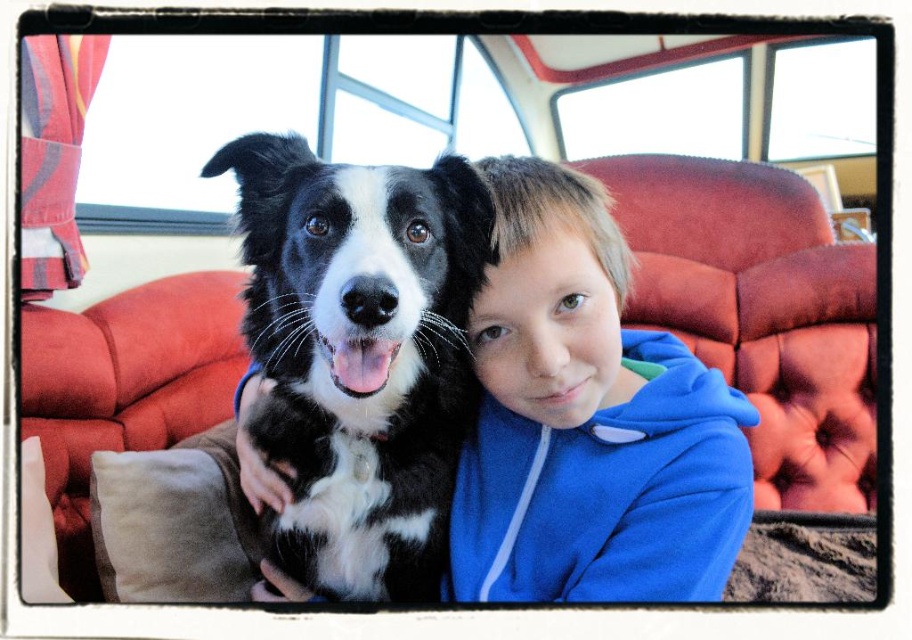
Question: Can you confirm if blue fleece jacket at center is wider than black and white fur at center?

Choices:
 (A) no
 (B) yes

Answer: (B)

Question: Which object appears closest to the camera in this image?

Choices:
 (A) blue fleece jacket at center
 (B) black and white fur at center

Answer: (B)

Question: Is blue fleece jacket at center further to the viewer compared to black and white fur at center?

Choices:
 (A) no
 (B) yes

Answer: (B)

Question: Is blue fleece jacket at center further to the viewer compared to black and white fur at center?

Choices:
 (A) no
 (B) yes

Answer: (B)